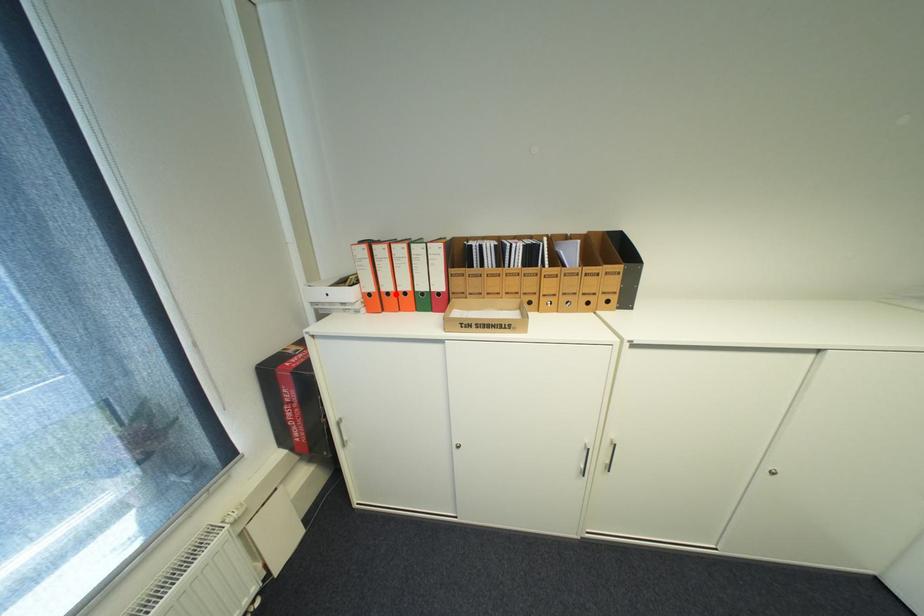
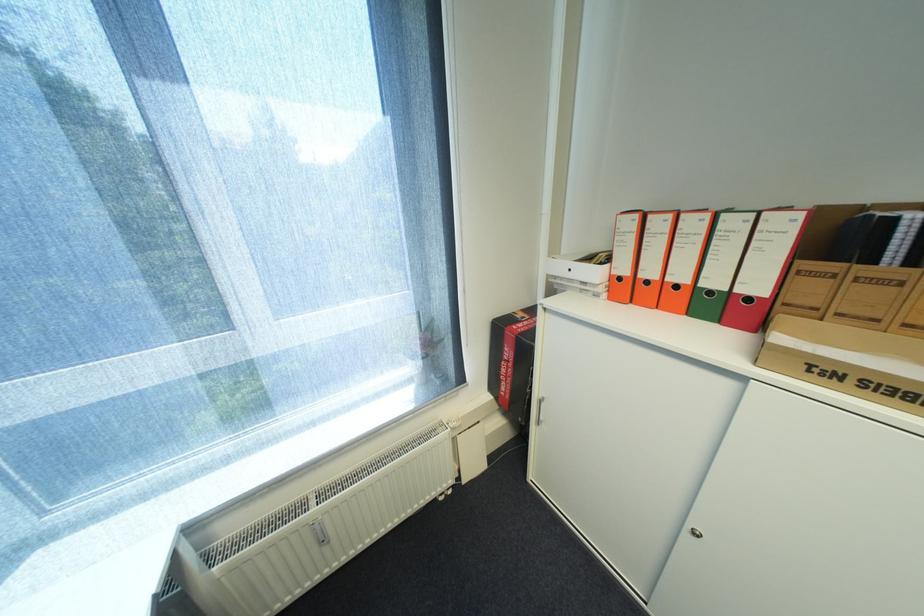
Find the pixel in the second image that matches the highlighted location in the first image.

(655, 283)